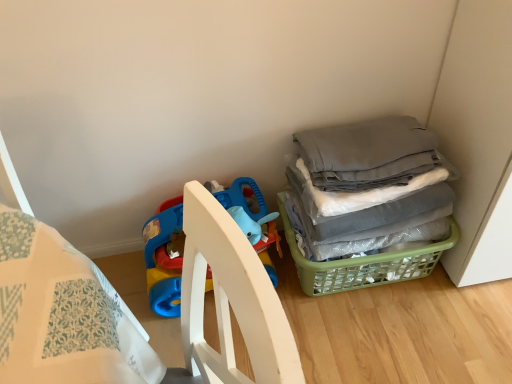
Identify the location of plastic blue playpen at lower left. (163, 262).

The height and width of the screenshot is (384, 512). What do you see at coordinates (364, 264) in the screenshot? I see `green plastic basket at lower right` at bounding box center [364, 264].

The height and width of the screenshot is (384, 512). In order to click on plastic blue playpen at lower left in this screenshot , I will do `click(163, 262)`.

Looking at this image, how many degrees apart are the facing directions of green plastic basket at lower right and plastic blue playpen at lower left?

0.000217 degrees separate the facing orientations of green plastic basket at lower right and plastic blue playpen at lower left.

Is green plastic basket at lower right next to plastic blue playpen at lower left?

No, green plastic basket at lower right is not beside plastic blue playpen at lower left.

Between green plastic basket at lower right and plastic blue playpen at lower left, which one has larger width?

green plastic basket at lower right.

Where is `toy positioned vertically above the green plastic basket at lower right (from a real-world perspective)`? This screenshot has width=512, height=384. toy positioned vertically above the green plastic basket at lower right (from a real-world perspective) is located at coordinates (163, 262).

From a real-world perspective, is plastic blue playpen at lower left positioned over gray fabric at right based on gravity?

No, from a real-world perspective, plastic blue playpen at lower left is not above gray fabric at right.

How different are the orientations of plastic blue playpen at lower left and gray fabric at right in degrees?

The angular difference between plastic blue playpen at lower left and gray fabric at right is 0.000111 degrees.

Is plastic blue playpen at lower left at the left side of gray fabric at right?

Yes, plastic blue playpen at lower left is to the left of gray fabric at right.

Is green plastic basket at lower right at the back of plastic blue playpen at lower left?

No, green plastic basket at lower right is not at the back of plastic blue playpen at lower left.

From the image's perspective, is plastic blue playpen at lower left above or below green plastic basket at lower right?

plastic blue playpen at lower left is above green plastic basket at lower right.

How distant is plastic blue playpen at lower left from green plastic basket at lower right?

plastic blue playpen at lower left and green plastic basket at lower right are 12.21 inches apart.

From a real-world perspective, is plastic blue playpen at lower left positioned above or below green plastic basket at lower right?

Clearly, from a real-world perspective, plastic blue playpen at lower left is above green plastic basket at lower right.

Consider the image. Is gray fabric at right at the left side of plastic blue playpen at lower left?

In fact, gray fabric at right is to the right of plastic blue playpen at lower left.

Which is less distant, (373, 203) or (163, 210)?

The point (373, 203) is closer to the camera.

From a real-world perspective, is gray fabric at right below plastic blue playpen at lower left?

No, from a real-world perspective, gray fabric at right is not beneath plastic blue playpen at lower left.

From the image's perspective, is gray fabric at right located above or below plastic blue playpen at lower left?

gray fabric at right is above plastic blue playpen at lower left.

How many degrees apart are the facing directions of green plastic basket at lower right and gray fabric at right?

The facing directions of green plastic basket at lower right and gray fabric at right are 0.000106 degrees apart.

Is the depth of green plastic basket at lower right greater than that of gray fabric at right?

Yes, green plastic basket at lower right is further from the viewer.

Consider the image. Between green plastic basket at lower right and gray fabric at right, which one has less height?

green plastic basket at lower right is shorter.

Does green plastic basket at lower right have a smaller size compared to gray fabric at right?

Yes, green plastic basket at lower right is smaller than gray fabric at right.

From the image's perspective, would you say gray fabric at right is shown under green plastic basket at lower right?

No.

Would you say gray fabric at right is a long distance from green plastic basket at lower right?

No, gray fabric at right is not far away from green plastic basket at lower right.

Between point (367, 249) and point (372, 276), which one is positioned behind?

The point (372, 276) is behind.

Who is bigger, gray fabric at right or green plastic basket at lower right?

→ gray fabric at right is bigger.

Find the location of a particular element. The height and width of the screenshot is (384, 512). basket located on the right of plastic blue playpen at lower left is located at coordinates (364, 264).

Find the location of a particular element. toy below the gray fabric at right (from the image's perspective) is located at coordinates [163, 262].

From the image, which object appears to be nearer to green plastic basket at lower right, plastic blue playpen at lower left or gray fabric at right?

gray fabric at right is closer to green plastic basket at lower right.

Which object lies further to the anchor point gray fabric at right, plastic blue playpen at lower left or green plastic basket at lower right?

Among the two, plastic blue playpen at lower left is located further to gray fabric at right.

Based on their spatial positions, is gray fabric at right or green plastic basket at lower right further from plastic blue playpen at lower left?

gray fabric at right is positioned further to the anchor plastic blue playpen at lower left.

Based on the photo, from the image, which object appears to be nearer to green plastic basket at lower right, gray fabric at right or plastic blue playpen at lower left?

The object closer to green plastic basket at lower right is gray fabric at right.

Which object lies nearer to the anchor point gray fabric at right, green plastic basket at lower right or plastic blue playpen at lower left?

Among the two, green plastic basket at lower right is located nearer to gray fabric at right.

When comparing their distances from plastic blue playpen at lower left, does green plastic basket at lower right or gray fabric at right seem closer?

green plastic basket at lower right.

Where is `basket between plastic blue playpen at lower left and gray fabric at right in the horizontal direction`? This screenshot has height=384, width=512. basket between plastic blue playpen at lower left and gray fabric at right in the horizontal direction is located at coordinates 364,264.